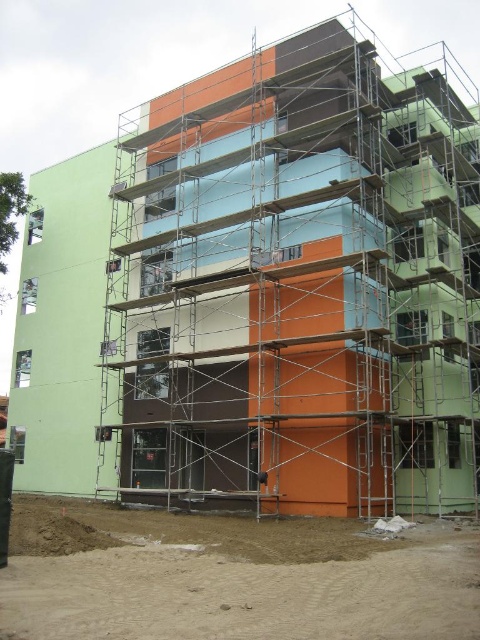
Does metal scaffolding at center appear on the right side of sandy dirt at lower left?

Correct, you'll find metal scaffolding at center to the right of sandy dirt at lower left.

Does metal scaffolding at center have a smaller size compared to sandy dirt at lower left?

Incorrect, metal scaffolding at center is not smaller in size than sandy dirt at lower left.

Between point (108, 422) and point (17, 509), which one is positioned in front?

Point (17, 509) is in front.

Locate an element on the screen. This screenshot has width=480, height=640. metal scaffolding at center is located at coordinates (300, 284).